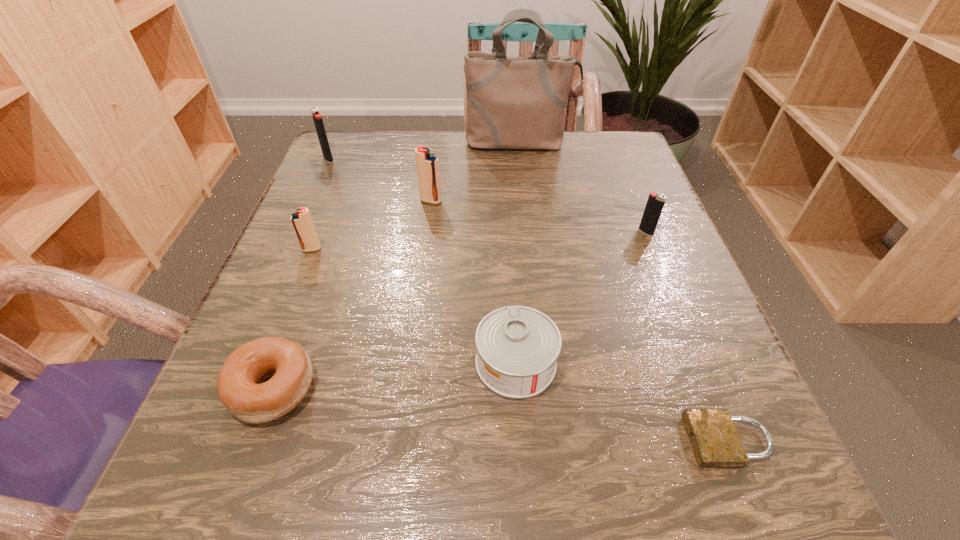
Identify the location of vacant space that's between the bagel and the bigger black igniter. (301, 273).

Where is `unoccupied area between the bagel and the smaller black igniter`? The height and width of the screenshot is (540, 960). unoccupied area between the bagel and the smaller black igniter is located at coordinates (460, 309).

Image resolution: width=960 pixels, height=540 pixels. Identify the location of empty location between the padlock and the silver can. (622, 402).

The height and width of the screenshot is (540, 960). Find the location of `vacant area that lies between the third farthest object and the smaller black igniter`. vacant area that lies between the third farthest object and the smaller black igniter is located at coordinates pos(539,217).

At what (x,y) coordinates should I click in order to perform the action: click on vacant space that's between the silver can and the bagel. Please return your answer as a coordinate pair (x, y). Image resolution: width=960 pixels, height=540 pixels. Looking at the image, I should click on (395, 375).

Locate an element on the screen. The image size is (960, 540). free space between the bagel and the tallest object is located at coordinates (396, 265).

Where is `vacant area that lies between the shortest object and the smaller black igniter`? Image resolution: width=960 pixels, height=540 pixels. vacant area that lies between the shortest object and the smaller black igniter is located at coordinates (687, 336).

This screenshot has height=540, width=960. I want to click on empty space between the bagel and the silver can, so click(x=395, y=375).

The height and width of the screenshot is (540, 960). I want to click on free point between the smaller red igniter and the bagel, so click(x=293, y=318).

The height and width of the screenshot is (540, 960). I want to click on object that is the third nearest to the farther black igniter, so click(512, 102).